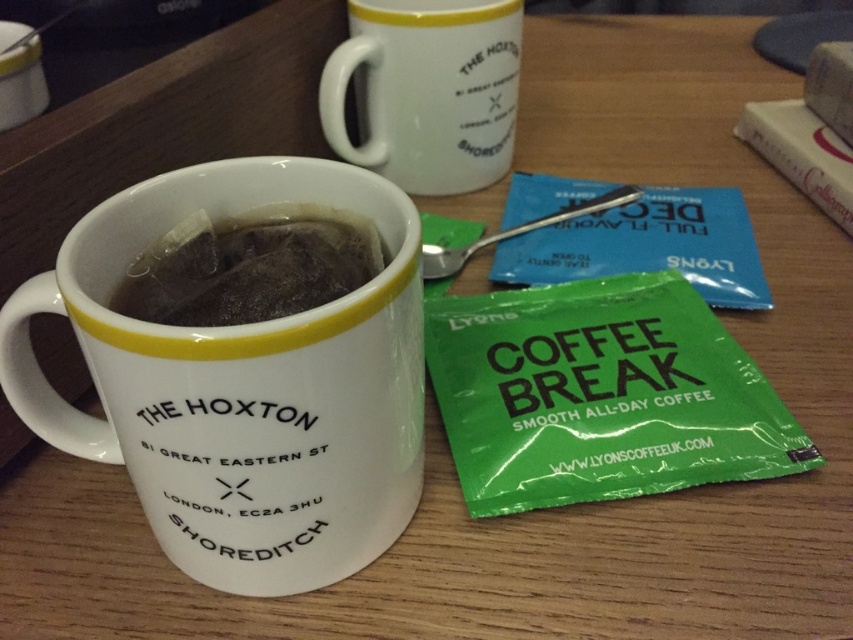
You are setting up a display for a coffee shop and need to arrange the white glossy mug at center and the white glossy mug at upper center on a shelf. Which mug should you place at the back to ensure the smaller one is visible?

You should place the white glossy mug at center at the back because it is larger, allowing the smaller white glossy mug at upper center to be visible in front.

You are arranging items on a table and see the white glossy mug at center and the white glossy mug at upper center. Which mug is positioned to the right side of the other?

The white glossy mug at upper center is to the right of the white glossy mug at center.